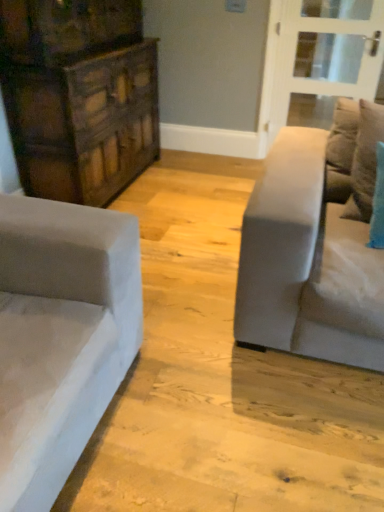
Identify the location of vacant space situated on the left part of light gray fabric couch at right. The image size is (384, 512). tap(184, 293).